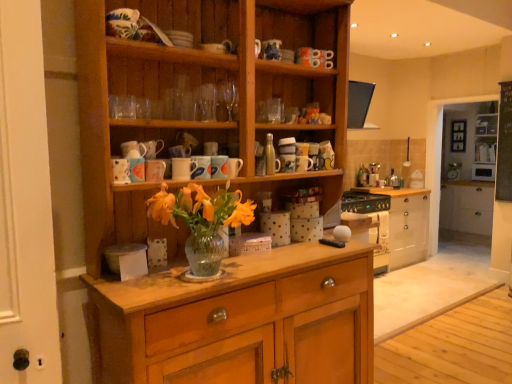
Measure the distance between point [156,161] and camera.

5.76 feet.

Measure the distance between matte ceramic mug at upper center, acting as the sixth mug starting from the right, and camera.

They are 5.31 feet apart.

Find the location of `transparent glass vase at center`. transparent glass vase at center is located at coordinates (202, 221).

This screenshot has width=512, height=384. What do you see at coordinates (467, 207) in the screenshot? I see `white painted wood cabinet at right` at bounding box center [467, 207].

I want to click on white painted wood cabinet at right, so click(x=467, y=207).

Where is `white glossy shelves at upper right, which is counted as the 2th shelf, starting from the front`? The image size is (512, 384). white glossy shelves at upper right, which is counted as the 2th shelf, starting from the front is located at coordinates (485, 150).

Describe the element at coordinates (25, 203) in the screenshot. I see `white glossy door at left` at that location.

The height and width of the screenshot is (384, 512). I want to click on white glossy door at left, so click(x=25, y=203).

At what (x,y) coordinates should I click in order to perform the action: click on white glossy cabinet at right, which is the first shelf in left-to-right order. Please return your answer as a coordinate pair (x, y). Looking at the image, I should click on (467, 172).

Considering the relative sizes of matte ceramic mug at center, which is the 6th mug from left to right, and wooden cabinet at center in the image provided, is matte ceramic mug at center, which is the 6th mug from left to right, smaller than wooden cabinet at center?

Yes.

Is matte ceramic mug at center, which is the 6th mug from left to right, facing away from wooden cabinet at center?

Correct, matte ceramic mug at center, which is the 6th mug from left to right, is looking away from wooden cabinet at center.

How many degrees apart are the facing directions of matte ceramic mug at center, which is the 6th mug from left to right, and wooden cabinet at center?

0.841 degrees separate the facing orientations of matte ceramic mug at center, which is the 6th mug from left to right, and wooden cabinet at center.

Is matte ceramic mug at upper center, which ranks as the second mug in left-to-right order, in front of or behind white glossy door at left in the image?

In the image, matte ceramic mug at upper center, which ranks as the second mug in left-to-right order, appears behind white glossy door at left.

Based on the photo, is matte ceramic mug at upper center, the 5th mug positioned from the right, facing towards white glossy door at left?

No, matte ceramic mug at upper center, the 5th mug positioned from the right, does not turn towards white glossy door at left.

Is matte ceramic mug at upper center, the 5th mug positioned from the right, bigger or smaller than white glossy door at left?

Considering their sizes, matte ceramic mug at upper center, the 5th mug positioned from the right, takes up less space than white glossy door at left.

Which object is thinner, matte ceramic mug at upper center, the 5th mug positioned from the right, or white glossy door at left?

Thinner between the two is matte ceramic mug at upper center, the 5th mug positioned from the right.

Where is `the 2nd mug to the left of the white glossy microwave at upper right, counting from the anchor's position`? This screenshot has width=512, height=384. the 2nd mug to the left of the white glossy microwave at upper right, counting from the anchor's position is located at coordinates (219, 167).

Is white glossy microwave at upper right surrounding glossy ceramic mug at upper center, positioned as the second mug in right-to-left order?

No, glossy ceramic mug at upper center, positioned as the second mug in right-to-left order, is not inside white glossy microwave at upper right.

Can you confirm if white glossy microwave at upper right is thinner than glossy ceramic mug at upper center, positioned as the second mug in right-to-left order?

Incorrect, the width of white glossy microwave at upper right is not less than that of glossy ceramic mug at upper center, positioned as the second mug in right-to-left order.

Considering the positions of objects white glossy microwave at upper right and glossy ceramic mug at upper center, which ranks as the fifth mug in left-to-right order, in the image provided, who is more to the left, white glossy microwave at upper right or glossy ceramic mug at upper center, which ranks as the fifth mug in left-to-right order,?

glossy ceramic mug at upper center, which ranks as the fifth mug in left-to-right order.

Is glossy ceramic mug at upper center, positioned as the second mug in right-to-left order, inside or outside of white glossy door at left?

glossy ceramic mug at upper center, positioned as the second mug in right-to-left order, is spatially situated outside white glossy door at left.

Find the location of a particular element. The height and width of the screenshot is (384, 512). the 5th mug above the white glossy door at left (from the image's perspective) is located at coordinates (219, 167).

Is glossy ceramic mug at upper center, which ranks as the fifth mug in left-to-right order, not close to white glossy door at left?

glossy ceramic mug at upper center, which ranks as the fifth mug in left-to-right order, is actually quite close to white glossy door at left.

You are a GUI agent. You are given a task and a screenshot of the screen. Output one action in this format:
    pyautogui.click(x=<x>, y=<y>)
    Task: Click on the shelf that is the 1st one when counting backward from the matte ceramic mug at upper center, the 5th mug positioned from the right
    
    Given the screenshot: What is the action you would take?
    pyautogui.click(x=467, y=172)

Is matte ceramic mug at upper center, which ranks as the second mug in left-to-right order, oriented towards white glossy cabinet at right, which is counted as the 2th shelf, starting from the back?

No.

Is matte ceramic mug at upper center, the 5th mug positioned from the right, beside white glossy cabinet at right, which is counted as the second shelf, starting from the right?

matte ceramic mug at upper center, the 5th mug positioned from the right, is not next to white glossy cabinet at right, which is counted as the second shelf, starting from the right, and they're not touching.

Which of these two, matte ceramic mug at upper center, the 5th mug positioned from the right, or white glossy cabinet at right, which is the first shelf in left-to-right order, is bigger?

white glossy cabinet at right, which is the first shelf in left-to-right order.

Considering their positions, is transparent glass vase at center located in front of or behind white glossy shelves at upper right, the first shelf in the right-to-left sequence?

In the image, transparent glass vase at center appears in front of white glossy shelves at upper right, the first shelf in the right-to-left sequence.

Considering the relative positions of transparent glass vase at center and white glossy shelves at upper right, which is counted as the 2th shelf, starting from the front, in the image provided, is transparent glass vase at center to the left of white glossy shelves at upper right, which is counted as the 2th shelf, starting from the front, from the viewer's perspective?

Indeed, transparent glass vase at center is positioned on the left side of white glossy shelves at upper right, which is counted as the 2th shelf, starting from the front.

Which is nearer, (209, 251) or (493, 161)?

Point (209, 251) is positioned closer to the camera compared to point (493, 161).

Considering the sizes of objects transparent glass vase at center and white glossy shelves at upper right, the first shelf positioned from the back, in the image provided, who is wider, transparent glass vase at center or white glossy shelves at upper right, the first shelf positioned from the back,?

With larger width is transparent glass vase at center.

Can you confirm if glossy ceramic mug at upper center, the third mug positioned from the right, is shorter than matte ceramic mug at center, acting as the first mug starting from the right?

Incorrect, the height of glossy ceramic mug at upper center, the third mug positioned from the right, does not fall short of that of matte ceramic mug at center, acting as the first mug starting from the right.

From a real-world perspective, does glossy ceramic mug at upper center, the third mug positioned from the right, sit lower than matte ceramic mug at center, which is the 6th mug from left to right?

Incorrect, from a real-world perspective, glossy ceramic mug at upper center, the third mug positioned from the right, is higher than matte ceramic mug at center, which is the 6th mug from left to right.

From the image's perspective, is glossy ceramic mug at upper center, the 4th mug from the left, under matte ceramic mug at center, which is the 6th mug from left to right?

Yes.

Locate an element on the screen. mug that is the 6th object located above the wooden cabinet at center (from the image's perspective) is located at coordinates (234, 167).

Where is `glass door that is below the matte ceramic mug at upper center, which ranks as the second mug in left-to-right order (from the image's perspective)`? glass door that is below the matte ceramic mug at upper center, which ranks as the second mug in left-to-right order (from the image's perspective) is located at coordinates (25, 203).

Considering their positions, is glossy ceramic mug at upper center, positioned as the second mug in right-to-left order, positioned closer to white glossy microwave at upper right than matte ceramic mug at upper center, positioned as the first mug in left-to-right order?

The object closer to white glossy microwave at upper right is glossy ceramic mug at upper center, positioned as the second mug in right-to-left order.

Which object lies nearer to the anchor point glossy ceramic mug at upper center, the 4th mug from the left, white painted wood chest of drawers at center or white glossy mug at center, arranged as the 4th mug when viewed from the right?

The object closer to glossy ceramic mug at upper center, the 4th mug from the left, is white glossy mug at center, arranged as the 4th mug when viewed from the right.

When comparing their distances from white glossy cabinet at right, which is counted as the 2th shelf, starting from the back, does matte ceramic mug at upper center, acting as the sixth mug starting from the right, or matte ceramic mug at center, which is the 6th mug from left to right, seem closer?

Among the two, matte ceramic mug at center, which is the 6th mug from left to right, is located nearer to white glossy cabinet at right, which is counted as the 2th shelf, starting from the back.

Looking at the image, which one is located further to wooden cabinet at center, white painted wood chest of drawers at center or matte ceramic mug at upper center, acting as the sixth mug starting from the right?

white painted wood chest of drawers at center.

From the image, which object appears to be nearer to wooden cabinet at center, white glossy mug at center, marked as the third mug in a left-to-right arrangement, or white painted wood cabinet at right?

The object closer to wooden cabinet at center is white glossy mug at center, marked as the third mug in a left-to-right arrangement.

Looking at the image, which one is located further to transparent glass vase at center, matte ceramic mug at upper center, positioned as the first mug in left-to-right order, or white glossy cabinet at right, which is counted as the second shelf, starting from the right?

white glossy cabinet at right, which is counted as the second shelf, starting from the right, is positioned further to the anchor transparent glass vase at center.

When comparing their distances from transparent glass vase at center, does white glossy mug at center, marked as the third mug in a left-to-right arrangement, or white glossy shelves at upper right, positioned as the second shelf in left-to-right order, seem closer?

white glossy mug at center, marked as the third mug in a left-to-right arrangement, is closer to transparent glass vase at center.

When comparing their distances from white painted wood cabinet at right, does glossy ceramic mug at upper center, the 4th mug from the left, or matte ceramic mug at upper center, acting as the sixth mug starting from the right, seem further?

matte ceramic mug at upper center, acting as the sixth mug starting from the right, is positioned further to the anchor white painted wood cabinet at right.

At what (x,y) coordinates should I click in order to perform the action: click on cabinetry between white glossy mug at center, arranged as the 4th mug when viewed from the right, and white glossy shelves at upper right, the first shelf positioned from the back, in the front-back direction. Please return your answer as a coordinate pair (x, y). The width and height of the screenshot is (512, 384). Looking at the image, I should click on (467, 207).

This screenshot has height=384, width=512. In order to click on chest of drawers between glossy ceramic mug at upper center, positioned as the second mug in right-to-left order, and white glossy microwave at upper right, along the z-axis in this screenshot , I will do `click(406, 224)`.

The width and height of the screenshot is (512, 384). I want to click on appliance between glossy ceramic mug at upper center, which ranks as the fifth mug in left-to-right order, and white glossy shelves at upper right, which is counted as the 2th shelf, starting from the front, in the front-back direction, so click(483, 172).

Locate an element on the screen. This screenshot has height=384, width=512. shelf positioned between glossy ceramic mug at upper center, the third mug positioned from the right, and white painted wood cabinet at right from near to far is located at coordinates (467, 172).